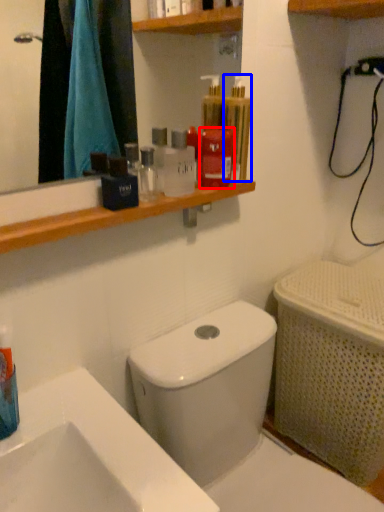
Question: Which of the following is the closest to the observer, mouthwash (highlighted by a red box) or mouthwash (highlighted by a blue box)?

Choices:
 (A) mouthwash
 (B) mouthwash

Answer: (B)